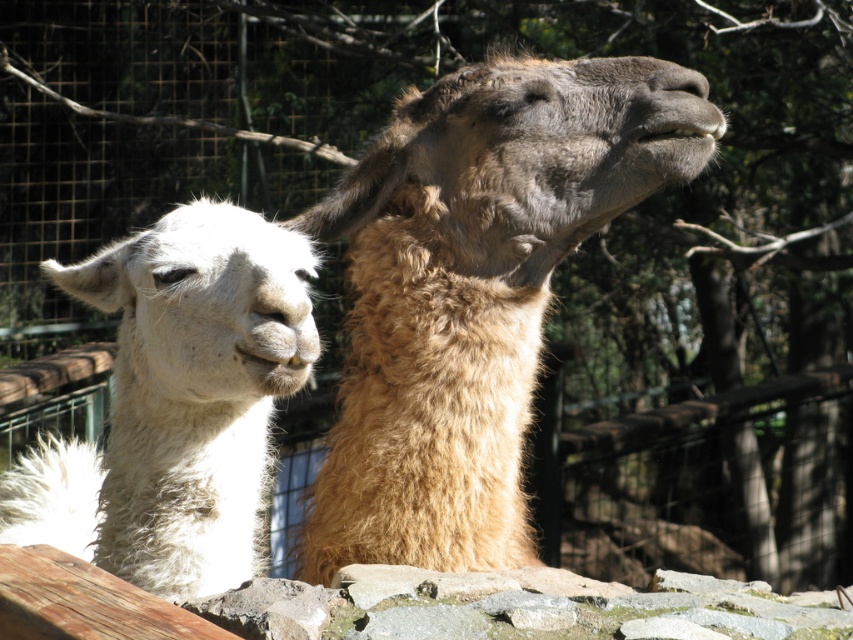
Question: Considering the relative positions of fuzzy brown alpaca at upper center and white fluffy alpaca at left in the image provided, where is fuzzy brown alpaca at upper center located with respect to white fluffy alpaca at left?

Choices:
 (A) above
 (B) below

Answer: (A)

Question: Which point appears closest to the camera in this image?

Choices:
 (A) (699, 129)
 (B) (50, 461)

Answer: (A)

Question: In this image, where is fuzzy brown alpaca at upper center located relative to white fluffy alpaca at left?

Choices:
 (A) right
 (B) left

Answer: (A)

Question: Which point is closer to the camera taking this photo?

Choices:
 (A) (402, 392)
 (B) (189, 477)

Answer: (B)

Question: Does fuzzy brown alpaca at upper center appear on the right side of white fluffy alpaca at left?

Choices:
 (A) no
 (B) yes

Answer: (B)